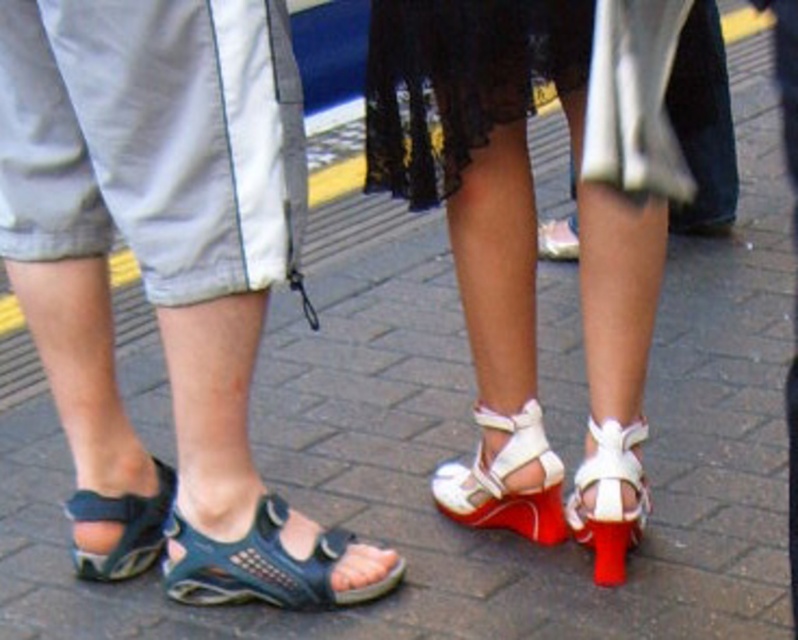
Which is more to the right, black mesh sandal at lower left or white leather sandal at lower right?

white leather sandal at lower right is more to the right.

Which is in front, point (271, 552) or point (587, 509)?

Point (271, 552) is in front.

Does point (257, 547) come behind point (633, 486)?

That is False.

Find the location of `black mesh sandal at lower left`. black mesh sandal at lower left is located at coordinates (263, 564).

Who is higher up, matte blue sandals at lower left or black mesh sandal at lower left?

matte blue sandals at lower left

Who is positioned more to the right, matte blue sandals at lower left or black mesh sandal at lower left?

black mesh sandal at lower left is more to the right.

Between point (174, 515) and point (216, 600), which one is positioned in front?

Positioned in front is point (174, 515).

Locate an element on the screen. matte blue sandals at lower left is located at coordinates (168, 262).

Measure the distance between matte blue sandals at lower left and camera.

A distance of 2.13 meters exists between matte blue sandals at lower left and camera.

Is matte blue sandals at lower left to the right of blue fabric sandal at lower left from the viewer's perspective?

Yes, matte blue sandals at lower left is to the right of blue fabric sandal at lower left.

Identify the location of matte blue sandals at lower left. (168, 262).

Where is `matte blue sandals at lower left`? matte blue sandals at lower left is located at coordinates (168, 262).